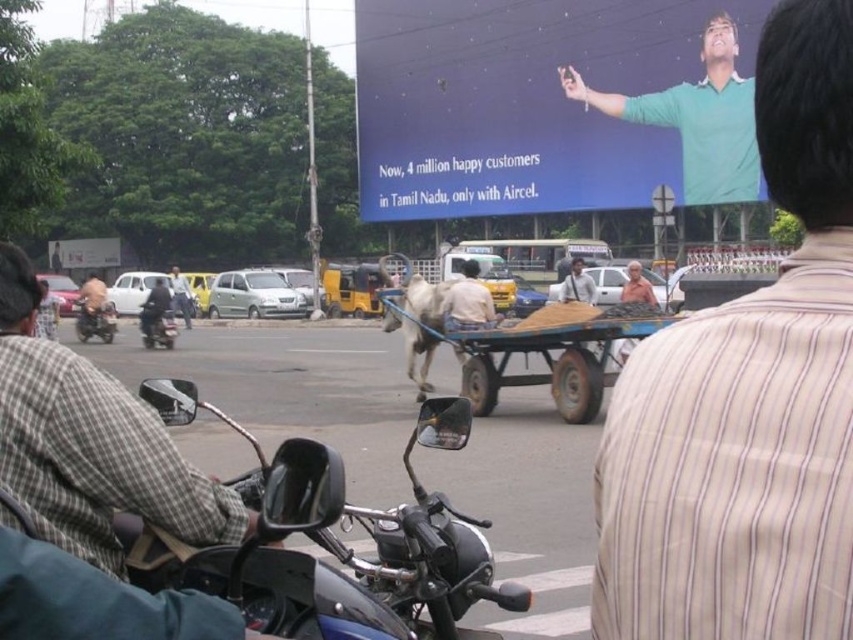
Question: In this image, where is shiny black motorcycle at center located relative to light brown shirt at center?

Choices:
 (A) above
 (B) below

Answer: (B)

Question: Among these points, which one is nearest to the camera?

Choices:
 (A) (178, 310)
 (B) (105, 291)
 (C) (83, 310)
 (D) (582, 77)

Answer: (C)

Question: Is shiny black motorcycle at center in front of dark blue shirt at left?

Choices:
 (A) yes
 (B) no

Answer: (A)

Question: Estimate the real-world distances between objects in this image. Which object is closer to the shiny black motorcycle at center?

Choices:
 (A) checkered fabric shirt at left
 (B) light brown shirt at center
 (C) shiny chrome motorcycle at center
 (D) blue matte billboard at upper center

Answer: (B)

Question: Which of the following is the farthest from the observer?

Choices:
 (A) blue matte billboard at upper center
 (B) checkered fabric shirt at left

Answer: (A)

Question: Does blue matte billboard at upper center have a smaller size compared to blue wooden cart at center?

Choices:
 (A) yes
 (B) no

Answer: (B)